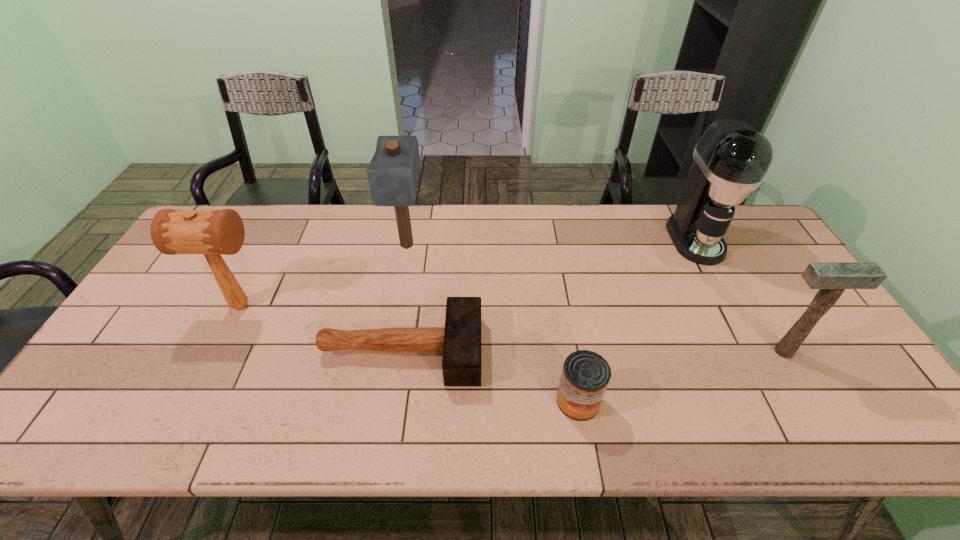
The width and height of the screenshot is (960, 540). In order to click on free space in the image that satisfies the following two spatial constraints: 1. on the hammer head face of the shortest mallet; 2. on the left side of the can in this screenshot , I will do `click(394, 401)`.

Locate an element on the screen. This screenshot has width=960, height=540. vacant point that satisfies the following two spatial constraints: 1. on the hammer head face of the can; 2. on the left side of the shortest mallet is located at coordinates (394, 401).

You are a GUI agent. You are given a task and a screenshot of the screen. Output one action in this format:
    pyautogui.click(x=<x>, y=<y>)
    Task: Click on the vacant space that satisfies the following two spatial constraints: 1. on the hammer head face of the shortest mallet; 2. on the back side of the rightmost mallet
    
    Given the screenshot: What is the action you would take?
    pyautogui.click(x=401, y=352)

You are a GUI agent. You are given a task and a screenshot of the screen. Output one action in this format:
    pyautogui.click(x=<x>, y=<y>)
    Task: Click on the free space that satisfies the following two spatial constraints: 1. on the hammer head face of the rightmost mallet; 2. on the right side of the shortest object
    The width and height of the screenshot is (960, 540).
    Given the screenshot: What is the action you would take?
    pyautogui.click(x=401, y=352)

You are a GUI agent. You are given a task and a screenshot of the screen. Output one action in this format:
    pyautogui.click(x=<x>, y=<y>)
    Task: Click on the free space that satisfies the following two spatial constraints: 1. place cup under the spout of the coffee maker; 2. on the hammer head face of the shortest object
    This screenshot has width=960, height=540.
    Given the screenshot: What is the action you would take?
    pyautogui.click(x=755, y=350)

Find the location of a particular element. vacant space that satisfies the following two spatial constraints: 1. on the front side of the farthest mallet; 2. on the strike surface of the leftmost mallet is located at coordinates (396, 305).

What are the coordinates of `vacant area in the image that satisfies the following two spatial constraints: 1. on the strike surface of the leftmost mallet; 2. on the back side of the rightmost mallet` in the screenshot? It's located at [x=217, y=352].